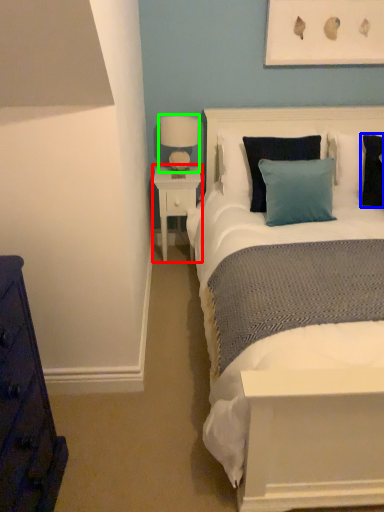
Question: Considering the real-world distances, which object is closest to nightstand (highlighted by a red box)? pillow (highlighted by a blue box) or table lamp (highlighted by a green box).

Choices:
 (A) pillow
 (B) table lamp

Answer: (B)